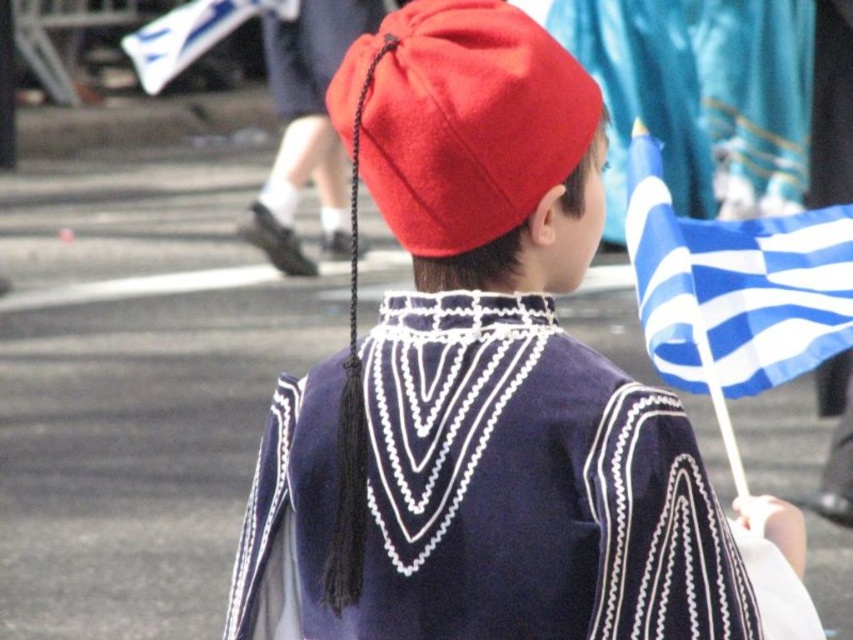
You are a photographer trying to capture a clear shot of the matte red beret at center and the blue fabric flag at right. Based on their positions and sizes, which object should you focus on first to ensure both are in frame without moving the camera?

The matte red beret at center might be wider than the blue fabric flag at right, so you should focus on the matte red beret at center first to ensure it fits within the frame before adjusting for the blue fabric flag at right.

You are a photographer at the event and want to capture a clear photo of the matte red beret at center without the matte red cap at center blocking it. Which object should you focus on to ensure the beret is visible?

The matte red beret at center is in front of the matte red cap at center, so focusing on the matte red beret at center will ensure it appears clearly without the cap blocking it.